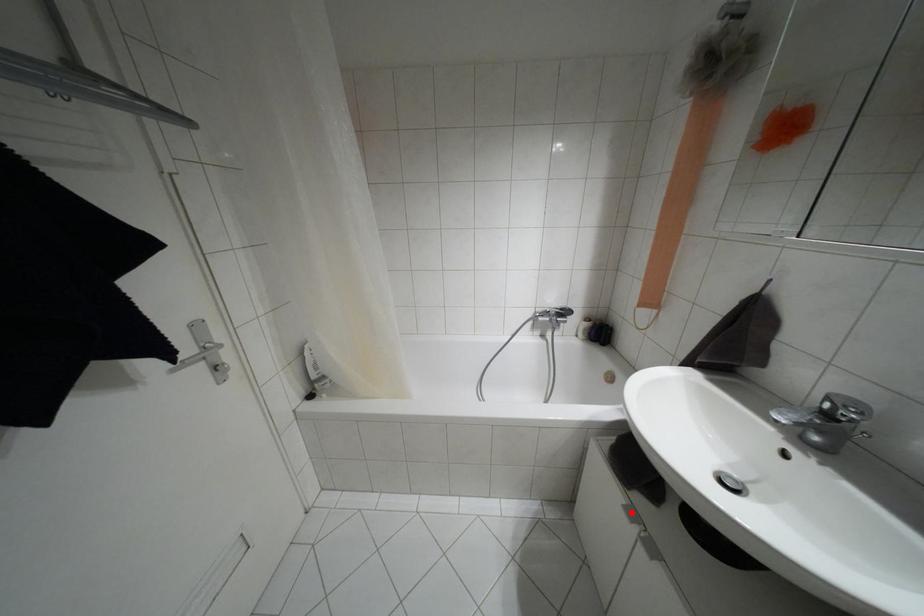
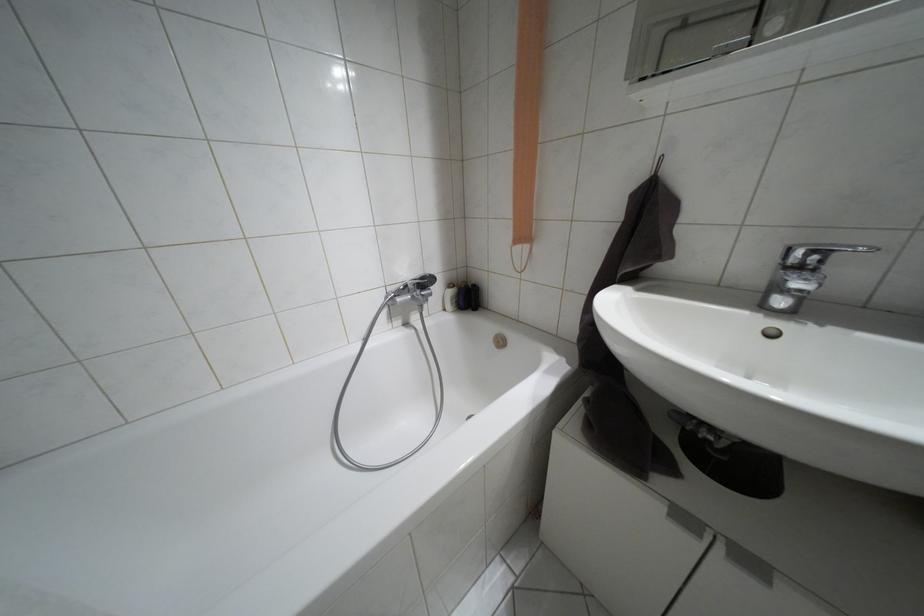
The point at the highlighted location is marked in the first image. Where is the corresponding point in the second image?

(684, 517)